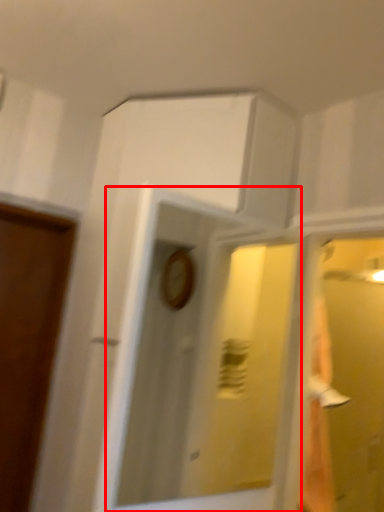
Question: In this image, where is mirror (annotated by the red box) located relative to glass door?

Choices:
 (A) left
 (B) right

Answer: (A)